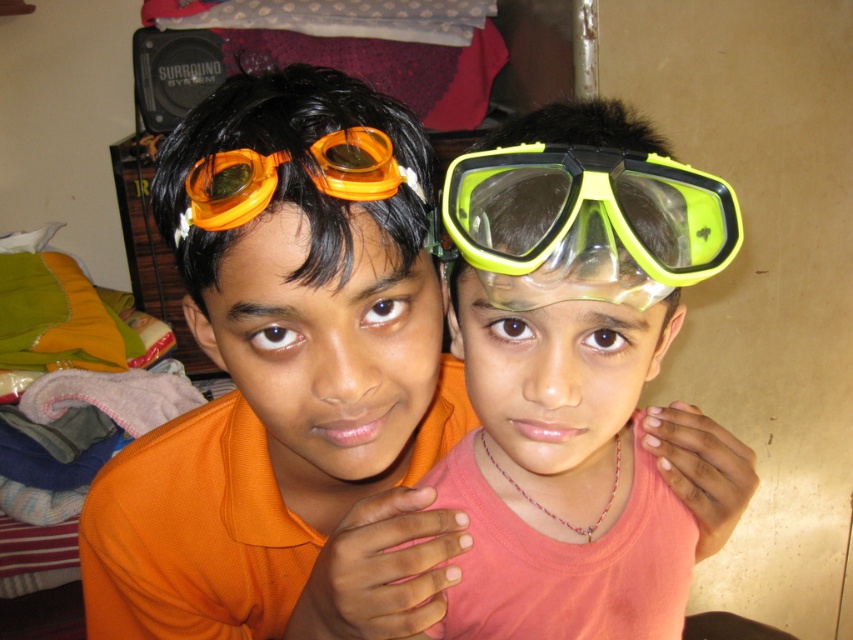
Question: Which of the following is the closest to the observer?

Choices:
 (A) (483, 166)
 (B) (260, 209)

Answer: (A)

Question: Is translucent plastic goggles at center wider than orange matte/glossy goggles at upper left?

Choices:
 (A) no
 (B) yes

Answer: (B)

Question: Estimate the real-world distances between objects in this image. Which object is closer to the neon green plastic goggles at upper center?

Choices:
 (A) orange matte/glossy goggles at upper left
 (B) matte yellow-green snorkel mask at center
 (C) translucent plastic goggles at center
 (D) matte orange goggles at left

Answer: (B)

Question: Is neon green plastic goggles at upper center above orange matte/glossy goggles at upper left?

Choices:
 (A) yes
 (B) no

Answer: (B)

Question: Does translucent plastic goggles at center have a smaller size compared to matte orange goggles at left?

Choices:
 (A) yes
 (B) no

Answer: (B)

Question: Based on their relative distances, which object is farther from the translucent plastic goggles at center?

Choices:
 (A) matte yellow-green snorkel mask at center
 (B) matte orange goggles at left
 (C) neon green plastic goggles at upper center

Answer: (C)